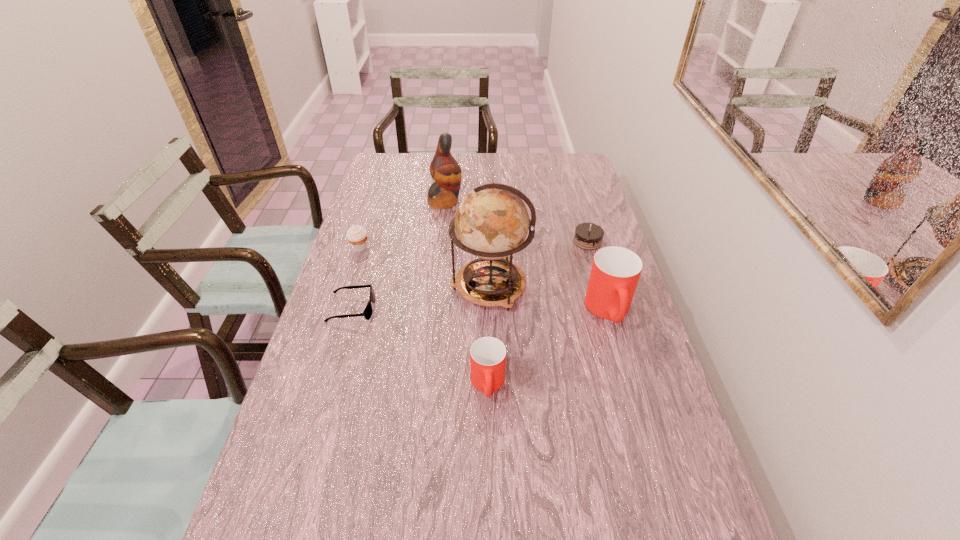
Locate an element on the screen. This screenshot has height=540, width=960. the shorter cup is located at coordinates (487, 354).

Find the location of a particular element. The width and height of the screenshot is (960, 540). the nearer cup is located at coordinates (487, 354).

Where is `the farther cup`? the farther cup is located at coordinates (615, 272).

Where is `the third tallest object`? the third tallest object is located at coordinates (615, 272).

Where is `globe`? globe is located at coordinates (491, 222).

Where is `parrot`? parrot is located at coordinates (446, 172).

This screenshot has height=540, width=960. I want to click on the sixth shortest object, so click(446, 172).

The image size is (960, 540). I want to click on the fifth tallest object, so click(x=357, y=236).

The height and width of the screenshot is (540, 960). I want to click on chocolate cake, so click(x=588, y=236).

At what (x,y) coordinates should I click in order to perform the action: click on sunglasses. Please return your answer as a coordinate pair (x, y). Looking at the image, I should click on (368, 310).